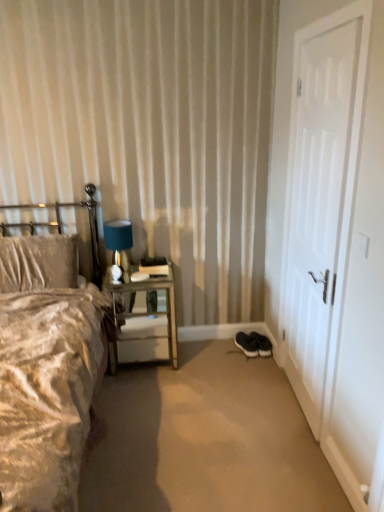
This screenshot has width=384, height=512. Find the location of `vacant space in front of metallic silver nightstand at left`. vacant space in front of metallic silver nightstand at left is located at coordinates (150, 393).